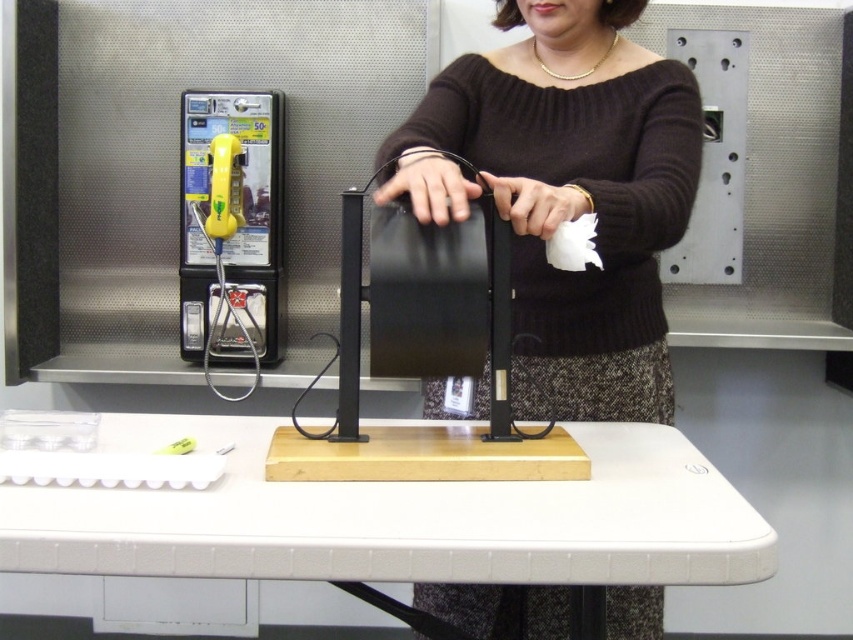
Question: Estimate the real-world distances between objects in this image. Which object is farther from the knitted dark brown sweater at center?

Choices:
 (A) yellow plastic phone at left
 (B) white plastic table at center

Answer: (A)

Question: Considering the real-world distances, which object is closest to the yellow plastic phone at left?

Choices:
 (A) white plastic table at center
 (B) knitted dark brown sweater at center

Answer: (B)

Question: Does knitted dark brown sweater at center have a lesser width compared to yellow plastic phone at left?

Choices:
 (A) yes
 (B) no

Answer: (B)

Question: Can you confirm if knitted dark brown sweater at center is positioned to the left of white plastic table at center?

Choices:
 (A) no
 (B) yes

Answer: (A)

Question: Considering the relative positions of knitted dark brown sweater at center and yellow plastic phone at left in the image provided, where is knitted dark brown sweater at center located with respect to yellow plastic phone at left?

Choices:
 (A) right
 (B) left

Answer: (A)

Question: Which of the following is the closest to the observer?

Choices:
 (A) yellow plastic phone at left
 (B) white plastic table at center
 (C) knitted dark brown sweater at center

Answer: (B)